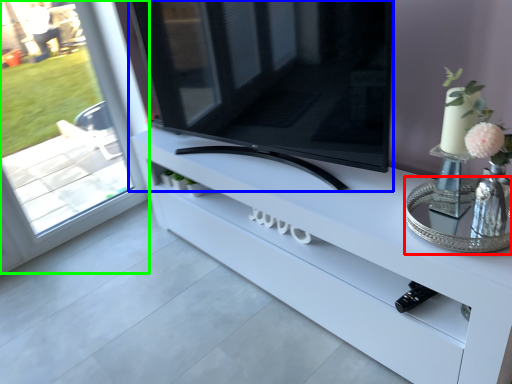
Question: Considering the real-world distances, which object is closest to glass table (highlighted by a red box)? television (highlighted by a blue box) or window (highlighted by a green box).

Choices:
 (A) television
 (B) window

Answer: (A)